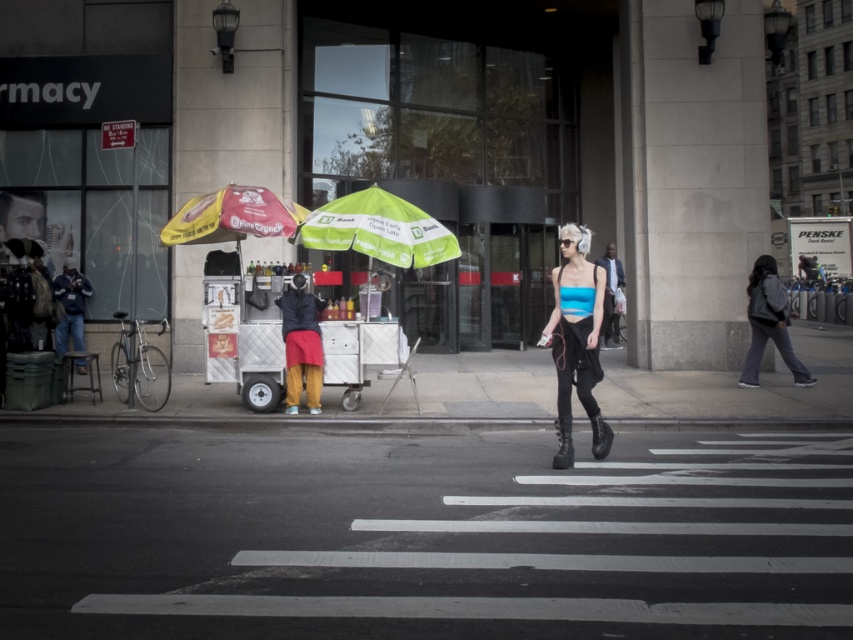
Question: Which of the following is the farthest from the observer?

Choices:
 (A) (244, 228)
 (B) (463, 609)

Answer: (A)

Question: Is the position of yellow fabric umbrella at center-left more distant than that of gray fabric backpack at right?

Choices:
 (A) no
 (B) yes

Answer: (A)

Question: From the image, what is the correct spatial relationship of white asphalt at crosswalk center in relation to yellow fabric umbrella at center-left?

Choices:
 (A) below
 (B) above

Answer: (A)

Question: Which of the following is the closest to the observer?

Choices:
 (A) blue matte crop top at center
 (B) white asphalt at crosswalk center
 (C) reddish-brown fabric cart at center-left

Answer: (B)

Question: Which point appears farthest from the camera in this image?

Choices:
 (A) (291, 220)
 (B) (554, 362)
 (C) (640, 618)
 (D) (386, 216)

Answer: (A)

Question: Can you confirm if reddish-brown fabric cart at center-left is positioned below gray fabric backpack at right?

Choices:
 (A) no
 (B) yes

Answer: (B)